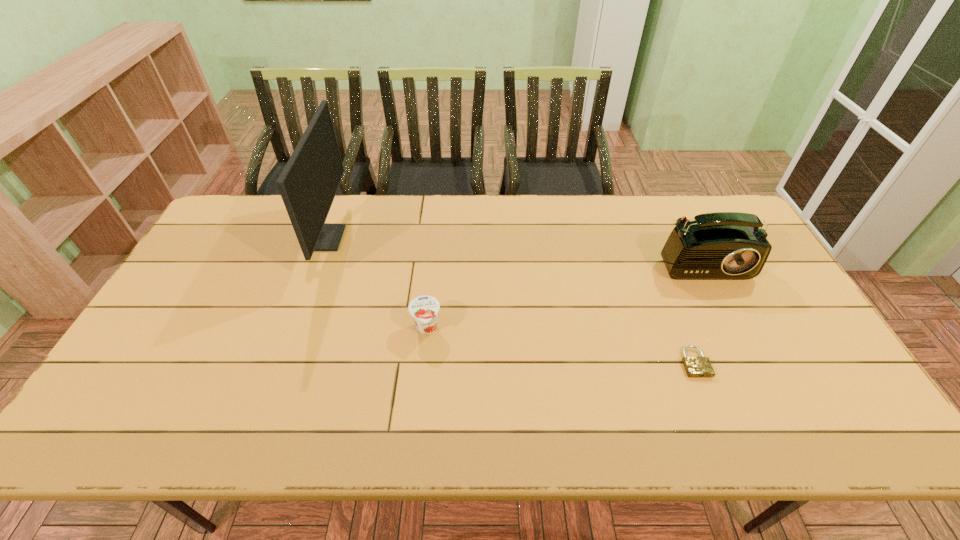
The width and height of the screenshot is (960, 540). Find the location of `computer monitor`. computer monitor is located at coordinates (308, 184).

The width and height of the screenshot is (960, 540). In order to click on the tallest object in this screenshot , I will do `click(308, 184)`.

Locate an element on the screen. This screenshot has width=960, height=540. the second tallest object is located at coordinates (723, 245).

I want to click on the third farthest object, so click(x=424, y=309).

At what (x,y) coordinates should I click in order to perform the action: click on the second shortest object. Please return your answer as a coordinate pair (x, y). The width and height of the screenshot is (960, 540). Looking at the image, I should click on (424, 309).

Find the location of a particular element. The image size is (960, 540). the nearest object is located at coordinates (696, 366).

You are a GUI agent. You are given a task and a screenshot of the screen. Output one action in this format:
    pyautogui.click(x=<x>, y=<y>)
    Task: Click on the padlock
    
    Given the screenshot: What is the action you would take?
    pyautogui.click(x=696, y=366)

I want to click on vacant space positioned on the front-facing side of the computer monitor, so click(437, 239).

What are the coordinates of `vacant space located 0.280m on the front-facing side of the second tallest object` in the screenshot? It's located at (755, 363).

I want to click on vacant space located on the back of the third farthest object, so click(430, 300).